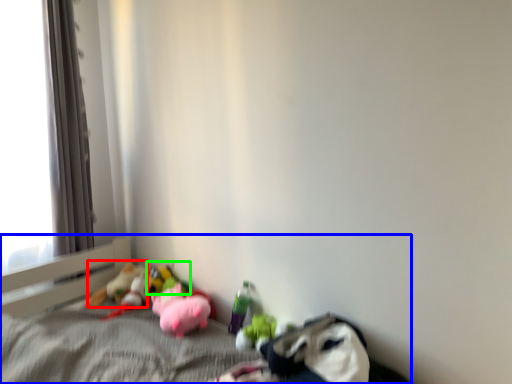
Question: Which object is the farthest from toy (highlighted by a red box)? Choose among these: bed (highlighted by a blue box) or toy (highlighted by a green box).

Choices:
 (A) bed
 (B) toy

Answer: (A)